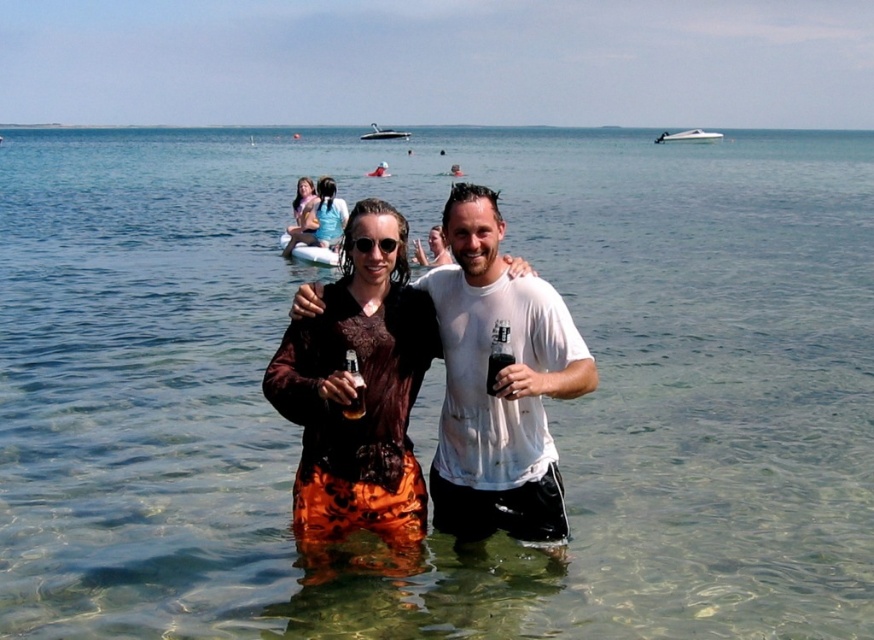
Question: Is matte pink bikini top at upper center to the left of black matte glass at center from the viewer's perspective?

Choices:
 (A) yes
 (B) no

Answer: (A)

Question: Estimate the real-world distances between objects in this image. Which object is closer to the translucent glass bottle at center?

Choices:
 (A) matte pink bikini top at upper center
 (B) white cotton t-shirt at center
 (C) blue fabric bikini top at center
 (D) black matte glass at center

Answer: (D)

Question: Is blue fabric bikini top at center thinner than matte black sunglasses at center?

Choices:
 (A) yes
 (B) no

Answer: (B)

Question: Among these points, which one is nearest to the camera?

Choices:
 (A) (503, 353)
 (B) (338, 228)

Answer: (A)

Question: Does black matte glass at center lie in front of translucent glass bottle at center?

Choices:
 (A) no
 (B) yes

Answer: (A)

Question: Which point is farther from the camera taking this photo?

Choices:
 (A) pos(324,218)
 (B) pos(296,228)

Answer: (B)